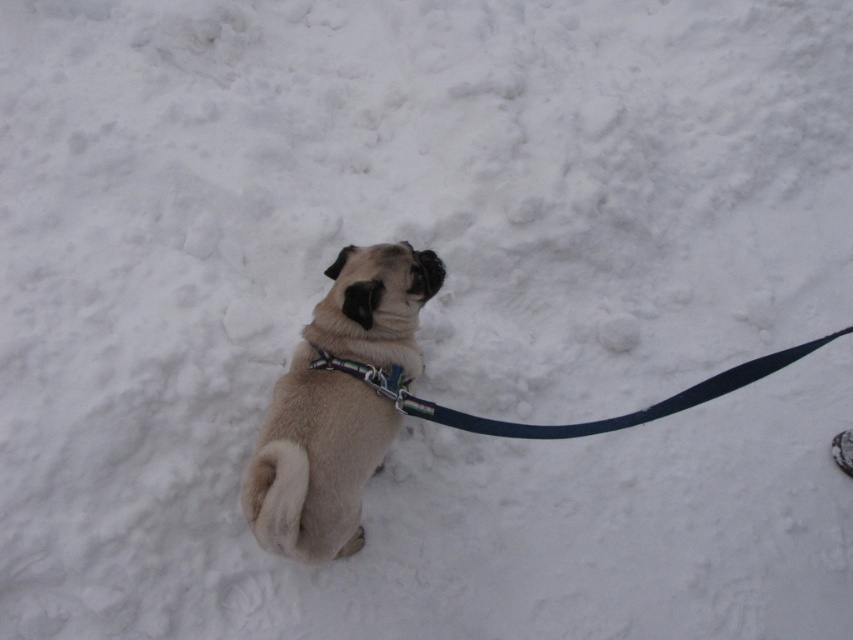
The pug is wearing a harness connected to two items. Which item is positioned lower between the black nylon leash at center and the metallic chain at center?

The black nylon leash at center is located below the metallic chain at center, so the black nylon leash at center is positioned lower.

Based on the scene description, can you determine which object is larger between the beige fur dog at center and the black nylon leash at center?

The beige fur dog at center is bigger than the black nylon leash at center according to the description.

You are a dog owner who wants to attach your dog to a leash. You see both the black nylon leash at center and the metallic chain at center. Which one is closer to you?

The black nylon leash at center is closer to the viewer than the metallic chain at center.